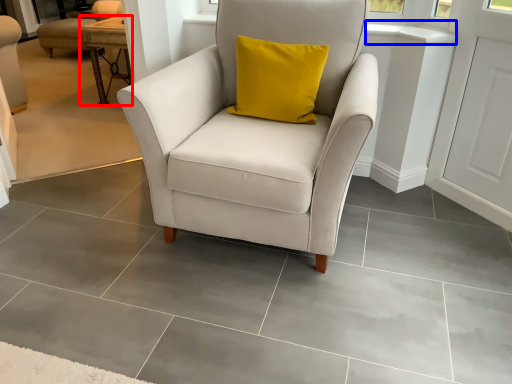
Question: Which object is closer to the camera taking this photo, table (highlighted by a red box) or window sill (highlighted by a blue box)?

Choices:
 (A) table
 (B) window sill

Answer: (B)